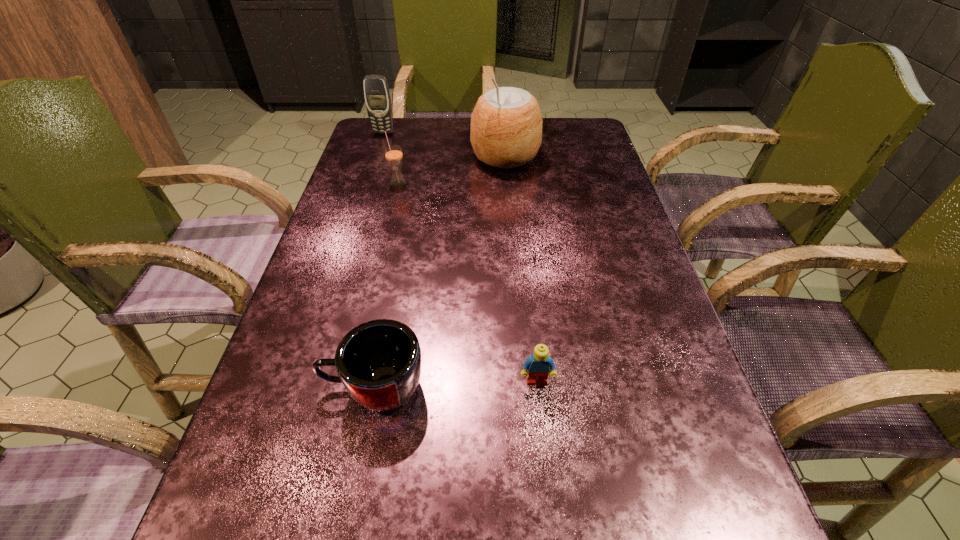
Find the location of `coconut`. coconut is located at coordinates (506, 125).

The width and height of the screenshot is (960, 540). Identify the location of the tallest object. (506, 125).

The width and height of the screenshot is (960, 540). I want to click on the farthest object, so click(377, 97).

Identify the location of cellular telephone. (377, 97).

Locate an element on the screen. The height and width of the screenshot is (540, 960). straw is located at coordinates (393, 153).

Where is `the third farthest object`? the third farthest object is located at coordinates (393, 153).

Where is `mug`? mug is located at coordinates (379, 362).

Where is `Lego`? The width and height of the screenshot is (960, 540). Lego is located at coordinates (536, 367).

Identify the location of vacant space situated 0.140m on the right of the fourth nearest object. This screenshot has width=960, height=540. (588, 157).

Find the location of a particular element. The width and height of the screenshot is (960, 540). free space located 0.250m on the front face of the farthest object is located at coordinates point(368,180).